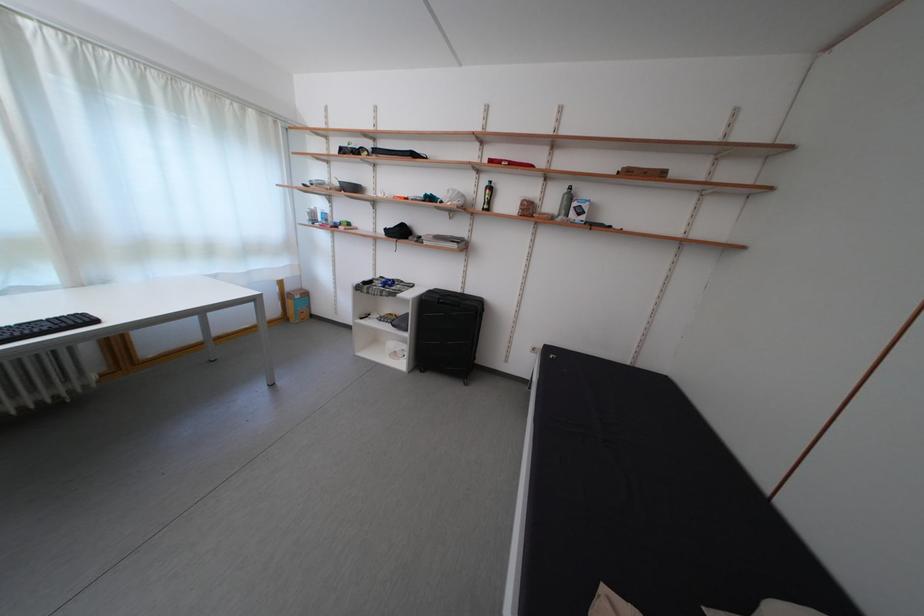
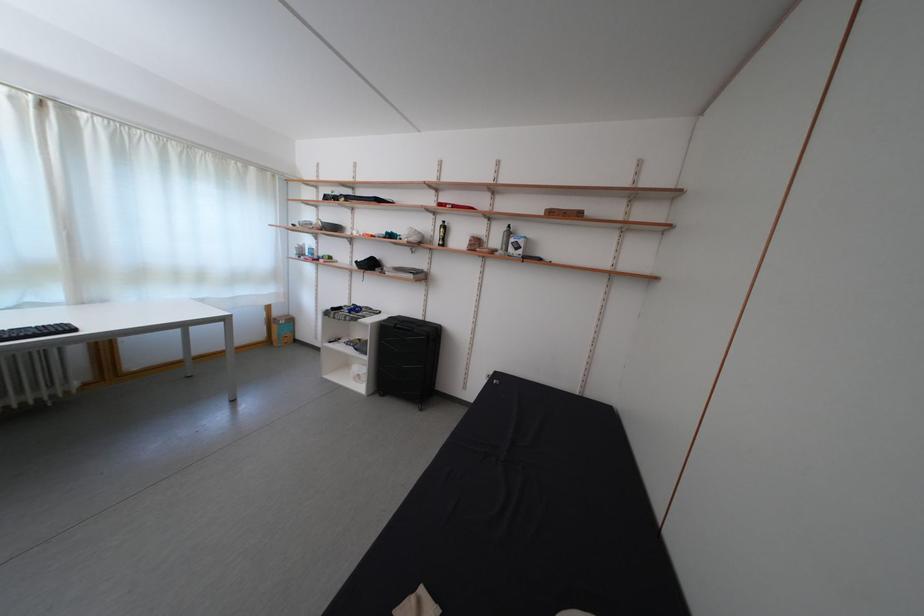
Where in the second image is the point corresponding to pixel 439 297 from the first image?

(399, 323)